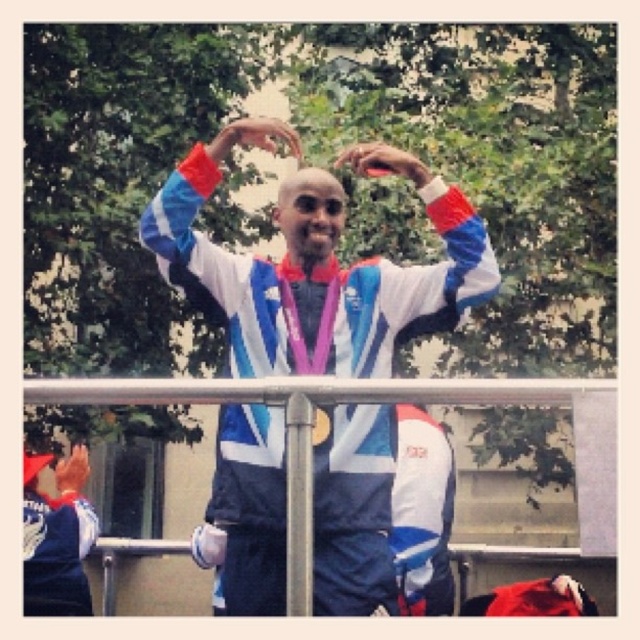
In the scene shown: You are a photographer at the event and want to capture a photo where both the metallic silver rail at center and the blue fabric jacket at left are visible. Based on their positions, which object should be placed on the right side of the photo frame?

The metallic silver rail at center should be placed on the right side of the photo frame because it is positioned on the right side of the blue fabric jacket at left.

You are a photographer at the event and want to capture the metallic silver rail at center and the matte black hand at lower left in the same frame. Based on their positions, which object is closer to the camera?

The matte black hand at lower left is closer to the camera because the metallic silver rail at center is located above it, indicating it is further away.